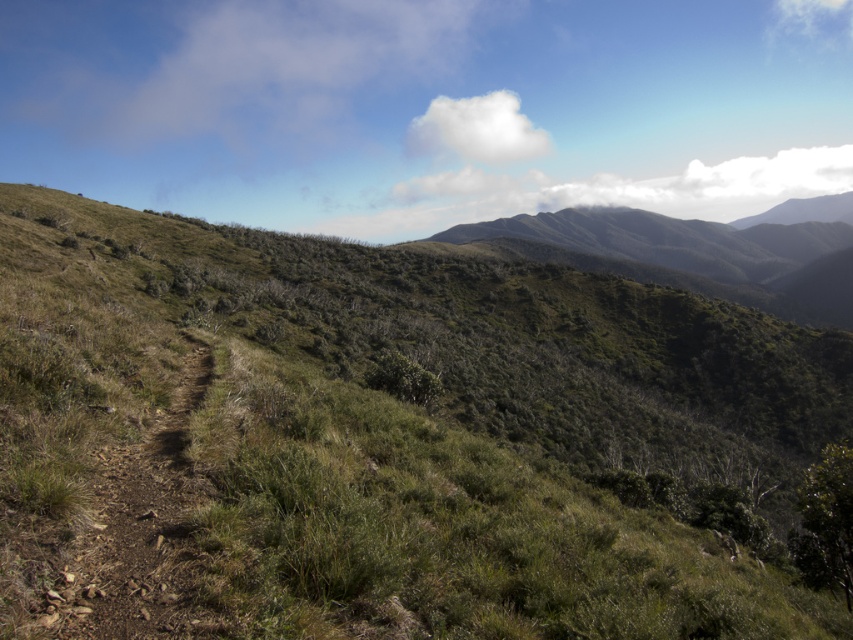
You are standing at the starting point of the dirt path in the foreground. You want to reach the green grassy mountain at upper center. Which direction should you walk relative to the green grassy hillside at center?

You should walk to the right of the green grassy hillside at center to reach the green grassy mountain at upper center since the green grassy hillside at center is to the left of the green grassy mountain at upper center.

You are a hiker planning to traverse the narrow dirt path through the green grassy hillside at center and the green grassy mountain at upper center. Which terrain feature is narrower in width?

The green grassy hillside at center is thinner than the green grassy mountain at upper center, so the green grassy hillside at center is narrower in width.